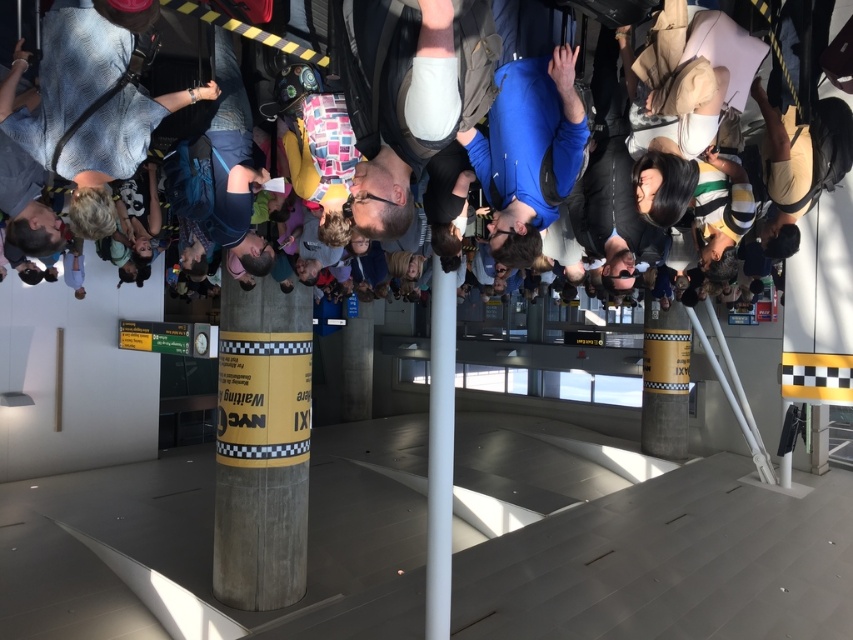
Question: Based on their relative distances, which object is nearer to the matte black backpack at upper center?

Choices:
 (A) wooden textured pillar at center
 (B) white smooth pole at center

Answer: (B)

Question: Observing the image, what is the correct spatial positioning of matte black backpack at upper center in reference to wooden textured pillar at center?

Choices:
 (A) right
 (B) left

Answer: (A)

Question: Can you confirm if wooden textured pillar at center is positioned above white smooth pole at center?

Choices:
 (A) yes
 (B) no

Answer: (B)

Question: Which object appears farthest from the camera in this image?

Choices:
 (A) wooden textured pillar at center
 (B) white smooth pole at center

Answer: (A)

Question: Can you confirm if wooden textured pillar at center is positioned to the right of white smooth pole at center?

Choices:
 (A) no
 (B) yes

Answer: (A)

Question: Which point appears closest to the camera in this image?

Choices:
 (A) (294, 301)
 (B) (120, 90)

Answer: (B)